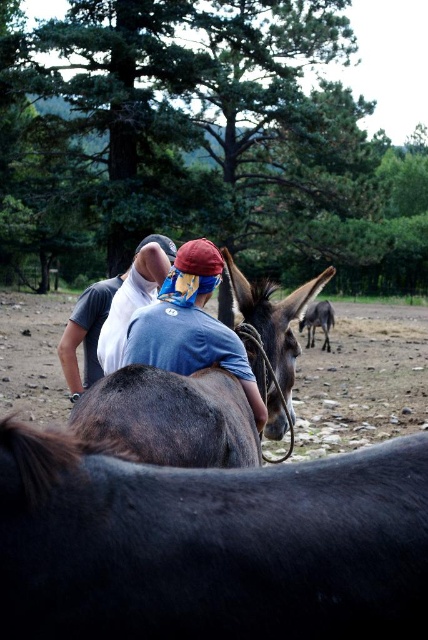
Looking at this image, measure the distance between dark brown leather mule at center and camera.

A distance of 8.76 feet exists between dark brown leather mule at center and camera.

How distant is dark brown leather mule at center from dark brown fur at center?

They are 17.46 feet apart.

Is point (294, 316) farther from camera compared to point (326, 323)?

No, (294, 316) is closer to viewer.

This screenshot has width=428, height=640. Find the location of `dark brown leather mule at center`. dark brown leather mule at center is located at coordinates (269, 316).

Based on the photo, can you confirm if blue fabric bandana at center is smaller than dark brown fur at center?

Yes, blue fabric bandana at center is smaller than dark brown fur at center.

Which is more to the left, blue fabric bandana at center or dark brown fur at center?

From the viewer's perspective, blue fabric bandana at center appears more on the left side.

Is point (196, 291) closer to viewer compared to point (311, 346)?

Yes, it is in front of point (311, 346).

Identify the location of blue fabric bandana at center. The image size is (428, 640). (190, 324).

Which is more to the right, black smooth mule at center or white fabric at center?

black smooth mule at center is more to the right.

Which is behind, point (88, 570) or point (130, 291)?

The point (130, 291) is more distant.

The image size is (428, 640). Find the location of `black smooth mule at center`. black smooth mule at center is located at coordinates (211, 545).